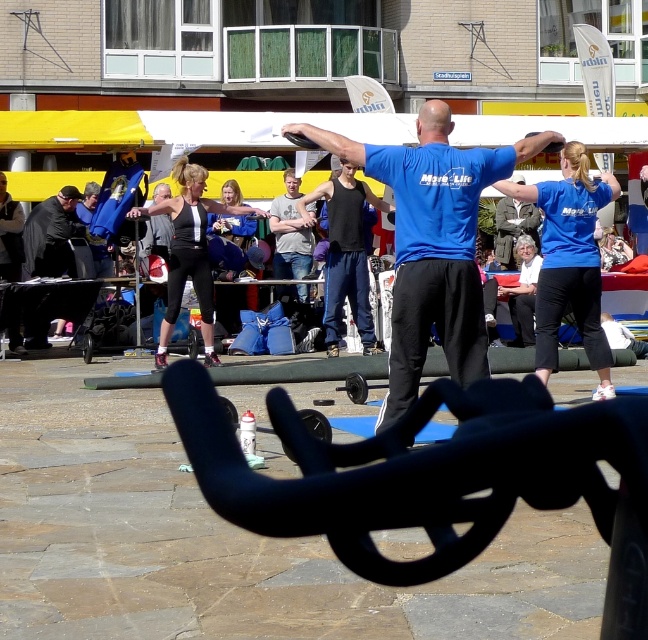
You are organizing a fitness class and need to arrange participants so that the person wearing the black matte leggings at center is to the left of the gray cotton shirt at center. Based on the current setup in the image, is this requirement already met?

Yes, the requirement is already met because the black matte leggings at center is positioned on the left side of the gray cotton shirt at center as described in the scene.

You are a photographer at the fitness event and need to capture a clear photo of both the black matte leggings at center and the gray cotton shirt at center. Which object should you focus on first if you want to ensure both are in focus?

The black matte leggings at center is taller than the gray cotton shirt at center. To ensure both are in focus, you should focus on the black matte leggings at center first, as it is larger and requires more precise focus.